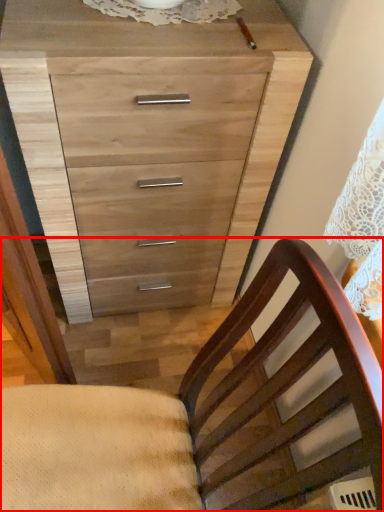
Question: Considering the relative positions of chair (annotated by the red box) and chest of drawers in the image provided, where is chair (annotated by the red box) located with respect to the staircase?

Choices:
 (A) right
 (B) left

Answer: (B)